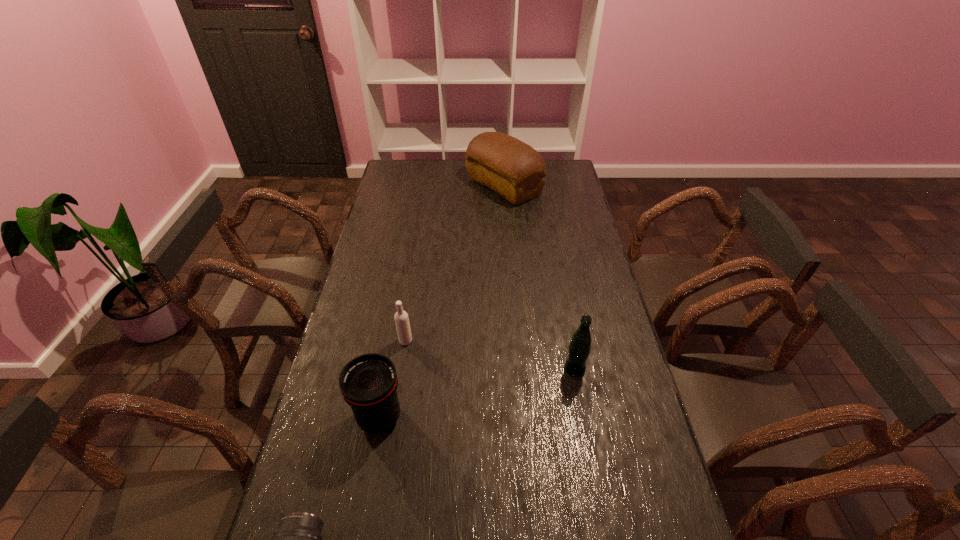
This screenshot has width=960, height=540. I want to click on object that is at the left edge, so click(x=368, y=383).

At what (x,y) coordinates should I click in order to perform the action: click on bread that is at the right edge. Please return your answer as a coordinate pair (x, y). The image size is (960, 540). Looking at the image, I should click on (513, 169).

This screenshot has height=540, width=960. What are the coordinates of `beer bottle that is at the right edge` in the screenshot? It's located at (579, 348).

The height and width of the screenshot is (540, 960). In order to click on object present at the far right corner in this screenshot , I will do `click(513, 169)`.

The width and height of the screenshot is (960, 540). Identify the location of vacant area at the left edge. [x=387, y=196].

What are the coordinates of `vacant space at the right edge of the desktop` in the screenshot? It's located at (579, 252).

Image resolution: width=960 pixels, height=540 pixels. In the image, there is a desktop. What are the coordinates of `vacant space at the far left corner` in the screenshot? It's located at (383, 183).

I want to click on free space at the far right corner of the desktop, so (564, 177).

Where is `free space between the taller telephoto lens and the farthest object`? The width and height of the screenshot is (960, 540). free space between the taller telephoto lens and the farthest object is located at coordinates (442, 302).

The width and height of the screenshot is (960, 540). Find the location of `vacant space in between the bread and the farther telephoto lens`. vacant space in between the bread and the farther telephoto lens is located at coordinates (442, 302).